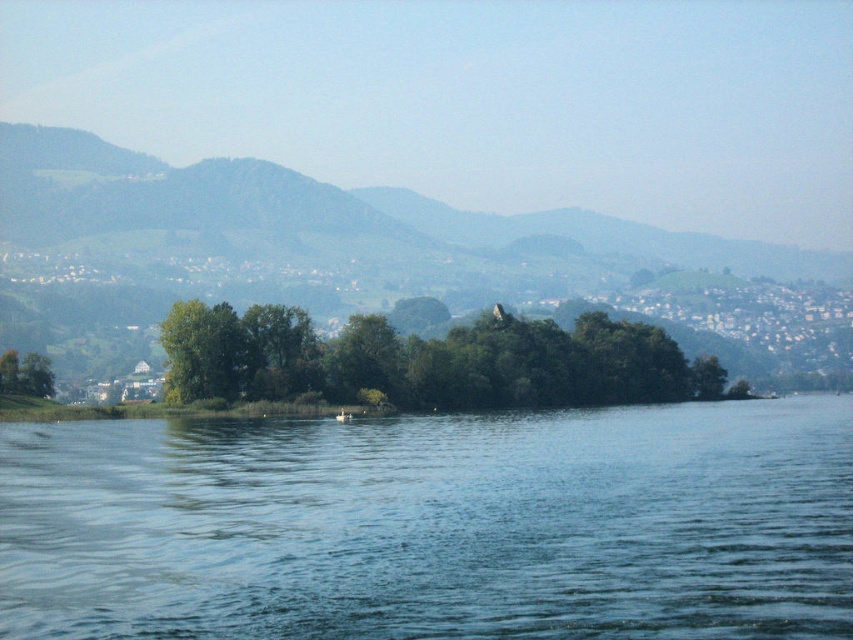
Question: Which of the following is the farthest from the observer?

Choices:
 (A) (264, 488)
 (B) (51, 390)

Answer: (B)

Question: Can you confirm if blue water at center is wider than green matte tree at lower left?

Choices:
 (A) no
 (B) yes

Answer: (B)

Question: Which object is farther from the camera taking this photo?

Choices:
 (A) green matte tree at lower left
 (B) green leafy trees at center
 (C) white plastic boat at center

Answer: (A)

Question: Is green leafy trees at center further to camera compared to green matte tree at lower left?

Choices:
 (A) yes
 (B) no

Answer: (B)

Question: Does green leafy trees at center appear on the right side of white plastic boat at center?

Choices:
 (A) yes
 (B) no

Answer: (A)

Question: Which object appears farthest from the camera in this image?

Choices:
 (A) green matte tree at lower left
 (B) green leafy trees at center
 (C) blue water at center

Answer: (A)